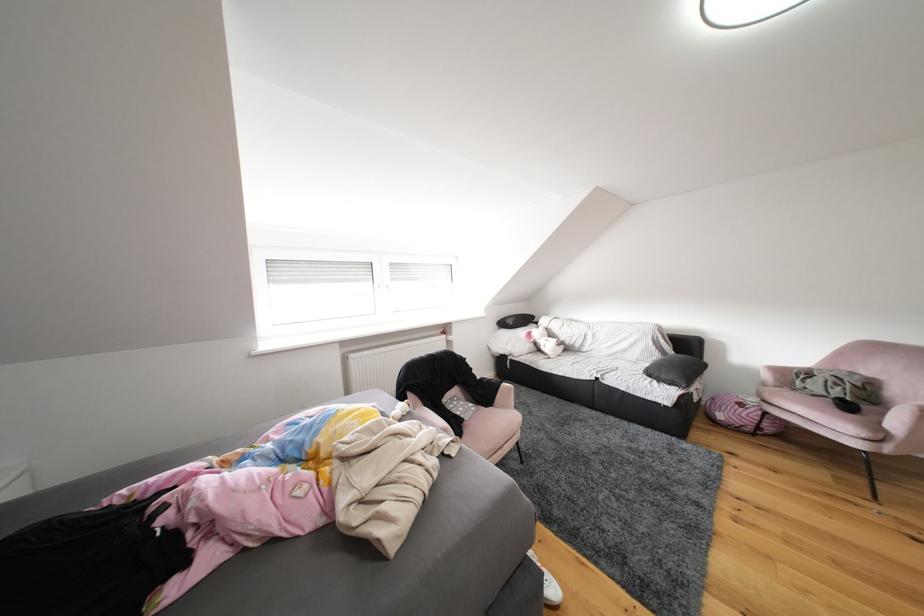
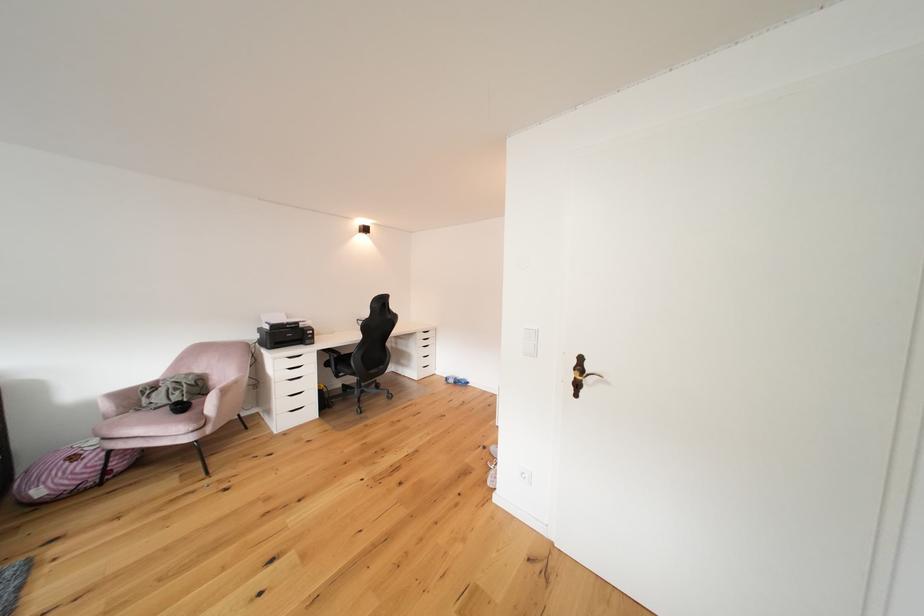
In the second image, find the point that corresponds to (x=857, y=411) in the first image.

(190, 411)